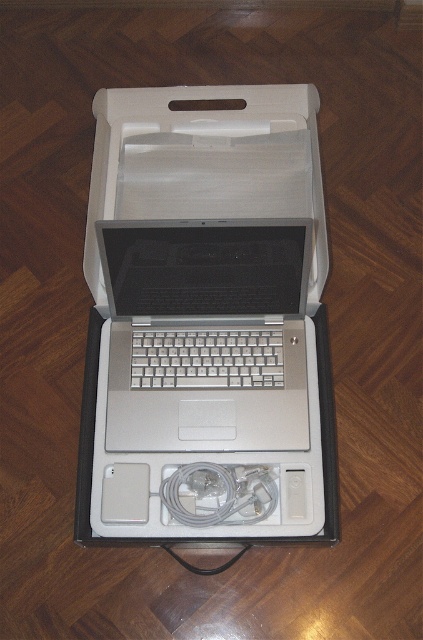
Question: Is white plastic box at center below silver metallic laptop at center?

Choices:
 (A) yes
 (B) no

Answer: (B)

Question: Estimate the real-world distances between objects in this image. Which object is closer to the silver metallic laptop at center?

Choices:
 (A) white plastic box at center
 (B) white matte charger at lower center

Answer: (A)

Question: Which object is positioned farthest from the white matte charger at lower center?

Choices:
 (A) silver metallic laptop at center
 (B) white plastic box at center

Answer: (B)

Question: Which of the following is the farthest from the observer?

Choices:
 (A) (293, 376)
 (B) (241, 518)

Answer: (A)

Question: Can you confirm if white plastic box at center is smaller than silver metallic laptop at center?

Choices:
 (A) no
 (B) yes

Answer: (A)

Question: From the image, what is the correct spatial relationship of white plastic box at center in relation to silver metallic laptop at center?

Choices:
 (A) below
 (B) above

Answer: (B)